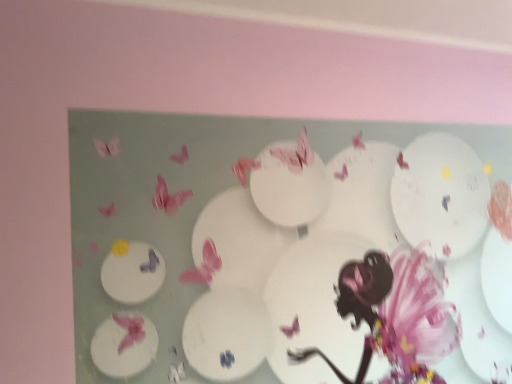
I want to click on white glossy egg at center, so click(301, 278).

What do you see at coordinates (301, 278) in the screenshot? I see `white glossy egg at center` at bounding box center [301, 278].

This screenshot has height=384, width=512. I want to click on white glossy egg at center, so click(x=301, y=278).